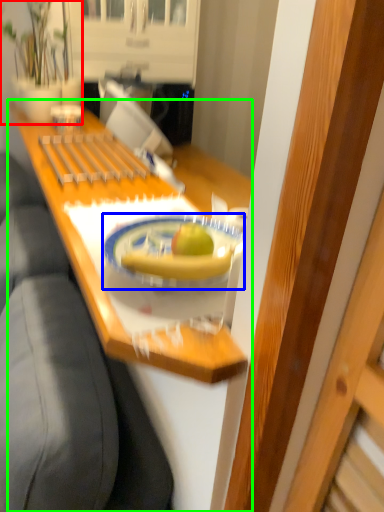
Question: Which object is the farthest from houseplant (highlighted by a red box)? Choose among these: plate (highlighted by a blue box) or desk (highlighted by a green box).

Choices:
 (A) plate
 (B) desk

Answer: (A)